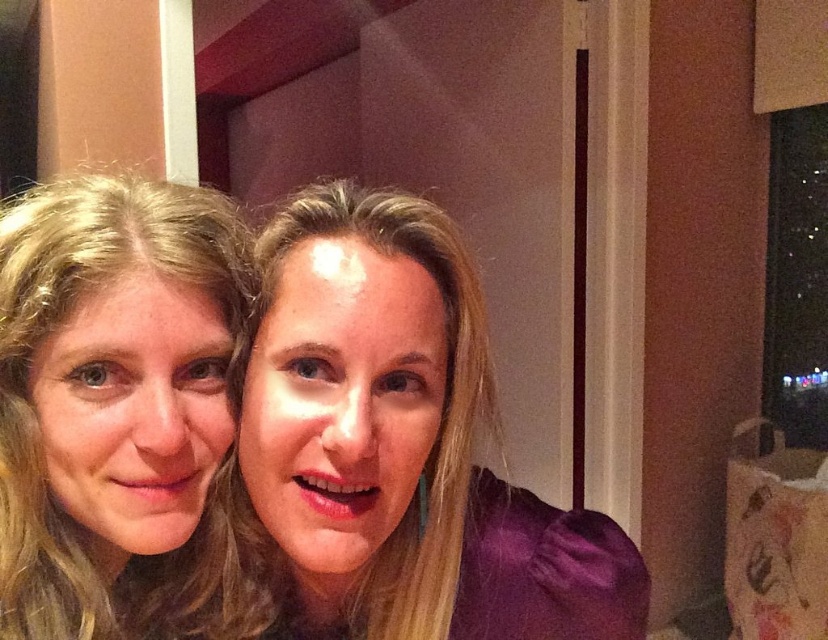
Is purple satin blouse at center taller than blonde hair at left?

Indeed, purple satin blouse at center has a greater height compared to blonde hair at left.

Can you confirm if purple satin blouse at center is smaller than blonde hair at left?

Actually, purple satin blouse at center might be larger than blonde hair at left.

Which is in front, point (540, 556) or point (181, 186)?

Point (181, 186) is more forward.

Identify the location of purple satin blouse at center. (398, 448).